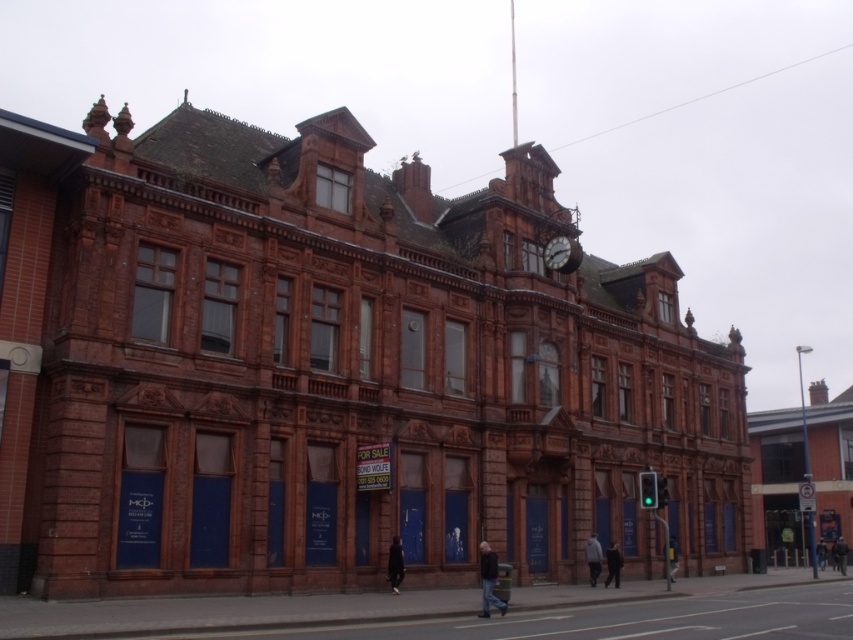
Question: Which object is farther from the camera taking this photo?

Choices:
 (A) dark blue jacket at lower center
 (B) matte brown clock at center
 (C) dark gray jacket at center
 (D) dark blue jeans at lower right

Answer: (C)

Question: Which object is positioned farthest from the dark gray jacket at center?

Choices:
 (A) dark blue jacket at lower right
 (B) light gray hoodie at center
 (C) dark blue jeans at lower center

Answer: (C)

Question: Is matte brown clock at center thinner than dark gray jacket at center?

Choices:
 (A) yes
 (B) no

Answer: (A)

Question: Can you confirm if light gray hoodie at center is positioned to the left of dark blue jacket at center?

Choices:
 (A) no
 (B) yes

Answer: (B)

Question: Which object is positioned farthest from the dark blue jacket at lower right?

Choices:
 (A) dark blue jacket at lower center
 (B) light gray hoodie at center
 (C) dark gray jacket at center

Answer: (C)

Question: In this image, where is matte brown clock at center located relative to dark blue jacket at lower right?

Choices:
 (A) above
 (B) below

Answer: (A)